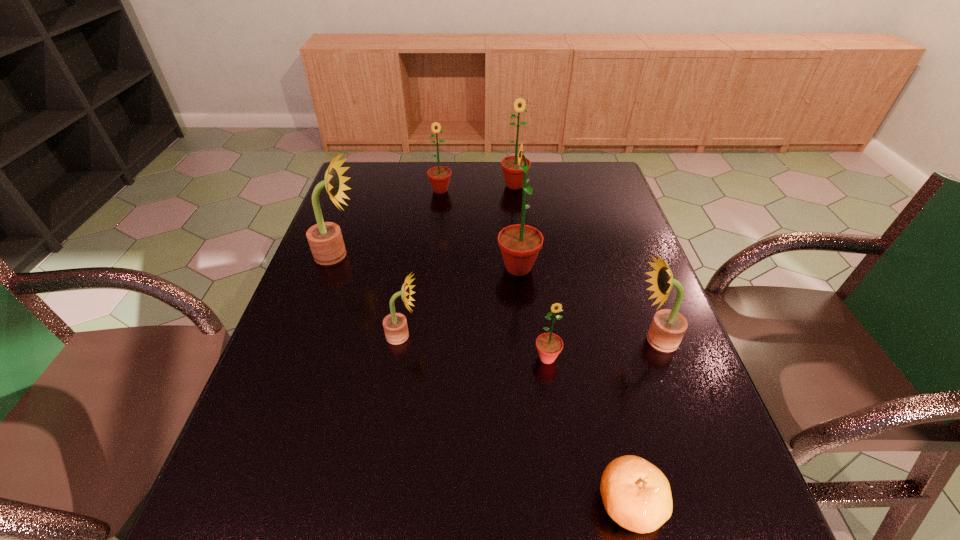
Image resolution: width=960 pixels, height=540 pixels. Identify the location of empty space that is in between the nearest green sunflower and the rightmost object. coord(602,349).

Where is `free space between the second biggest green sunflower and the second yellow sunflower from left to right`? free space between the second biggest green sunflower and the second yellow sunflower from left to right is located at coordinates (459, 260).

The image size is (960, 540). I want to click on vacant region between the leftmost yellow sunflower and the tallest object, so click(x=428, y=261).

I want to click on free area in between the second biggest green sunflower and the smallest green sunflower, so click(x=531, y=272).

The height and width of the screenshot is (540, 960). What are the coordinates of `object that is the second closest to the seventh object from left to right` in the screenshot? It's located at (668, 327).

Identify which object is the seventh nearest to the leftmost yellow sunflower. Please provide its 2D coordinates. Your answer should be formatted as a tuple, i.e. [(x, y)], where the tuple contains the x and y coordinates of a point satisfying the conditions above.

[(636, 494)]

Locate an element on the screen. sunflower that stands as the second closest to the third smallest green sunflower is located at coordinates (520, 244).

The image size is (960, 540). Find the location of `sunflower that stands as the closest to the third smallest green sunflower`. sunflower that stands as the closest to the third smallest green sunflower is located at coordinates (439, 176).

Where is `green sunflower that stands as the closest to the rightmost object`? This screenshot has height=540, width=960. green sunflower that stands as the closest to the rightmost object is located at coordinates (549, 345).

Locate an element on the screen. This screenshot has width=960, height=540. the second closest green sunflower to the rightmost object is located at coordinates (520, 244).